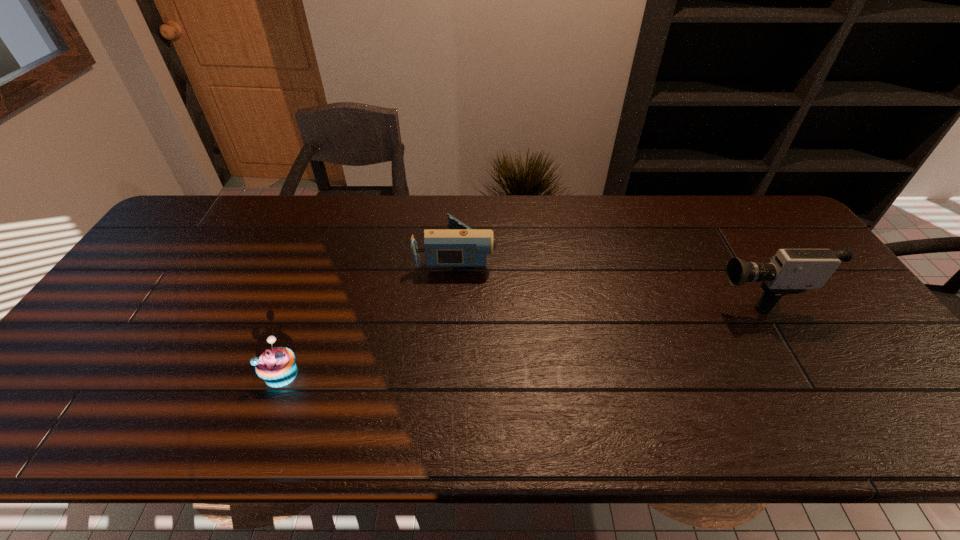
Find the location of a particular element. free space that satisfies the following two spatial constraints: 1. on the side of the left camcorder with the flip-out screen; 2. on the front side of the leftmost object is located at coordinates [x=449, y=374].